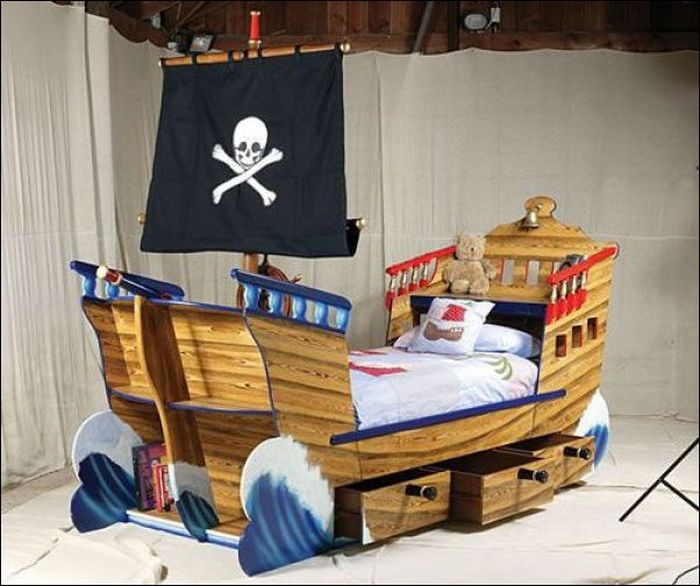
I want to click on mattress, so click(x=395, y=367).